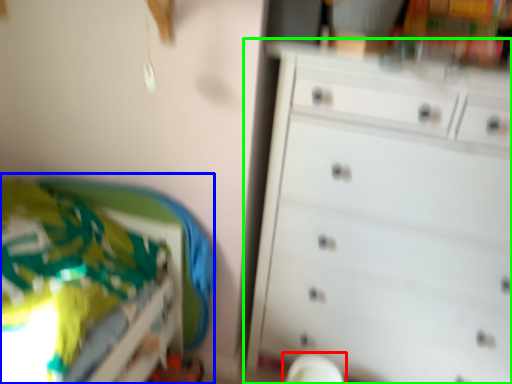
Question: Which object is positioned closest to swivel chair (highlighted by a red box)? Select from bed (highlighted by a blue box) and chest of drawers (highlighted by a green box).

Choices:
 (A) bed
 (B) chest of drawers

Answer: (B)